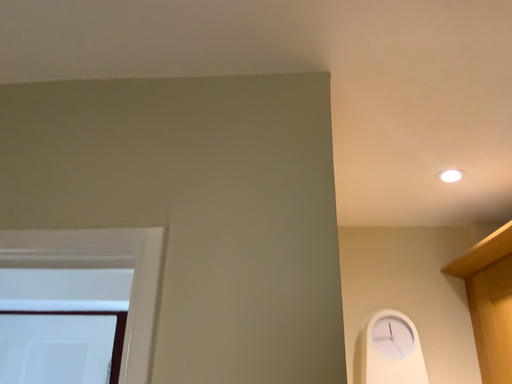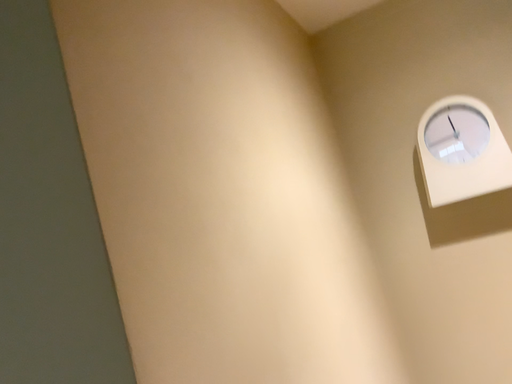
Question: Which way did the camera rotate in the video?

Choices:
 (A) rotated downward
 (B) rotated upward

Answer: (A)